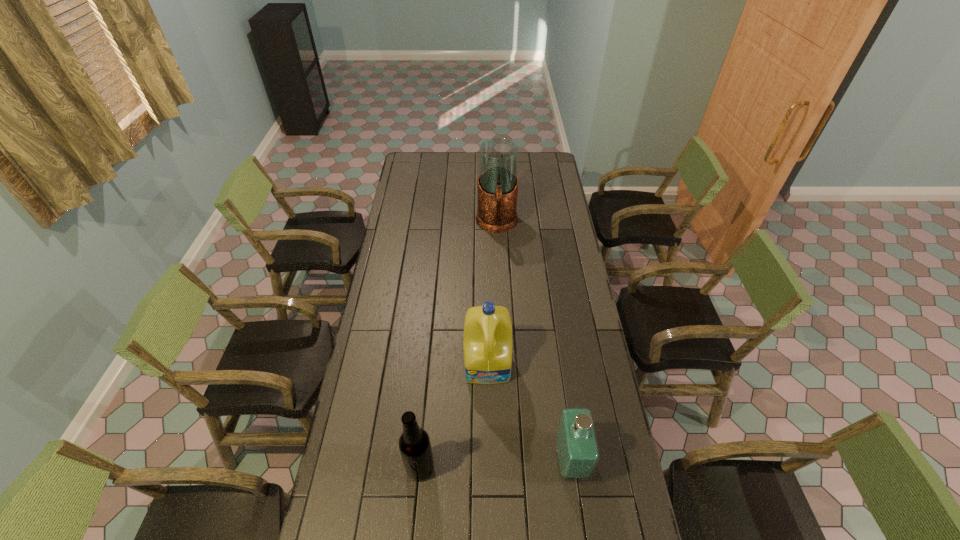
You are a GUI agent. You are given a task and a screenshot of the screen. Output one action in this format:
    pyautogui.click(x=<x>, y=<y>)
    Task: Click on the vacant area between the tallest object and the third nearest object
    
    Given the screenshot: What is the action you would take?
    pyautogui.click(x=492, y=294)

Where is `free space that is in between the detergent and the farthest object`? This screenshot has height=540, width=960. free space that is in between the detergent and the farthest object is located at coordinates (492, 294).

This screenshot has width=960, height=540. Identify the location of unoccupied area between the detergent and the leftmost object. (454, 416).

You are a GUI agent. You are given a task and a screenshot of the screen. Output one action in this format:
    pyautogui.click(x=<x>, y=<y>)
    Task: Click on the unoccupied area between the perfume and the tallest object
    
    Given the screenshot: What is the action you would take?
    pyautogui.click(x=534, y=342)

Find the location of a particular element. The height and width of the screenshot is (540, 960). free spot between the third nearest object and the perfume is located at coordinates (529, 413).

Where is `empty space between the leftmost object and the second farthest object`? Image resolution: width=960 pixels, height=540 pixels. empty space between the leftmost object and the second farthest object is located at coordinates (454, 416).

The image size is (960, 540). I want to click on vacant region between the shortest object and the second farthest object, so click(x=529, y=413).

At what (x,y) coordinates should I click in order to perform the action: click on unoccupied area between the perfume and the second farthest object. Please return your answer as a coordinate pair (x, y). This screenshot has height=540, width=960. Looking at the image, I should click on (529, 413).

Where is `vacant area that lies between the farthest object and the beer bottle`? The height and width of the screenshot is (540, 960). vacant area that lies between the farthest object and the beer bottle is located at coordinates (459, 346).

This screenshot has width=960, height=540. Find the location of `vacant space that's between the detergent and the rightmost object`. vacant space that's between the detergent and the rightmost object is located at coordinates (529, 413).